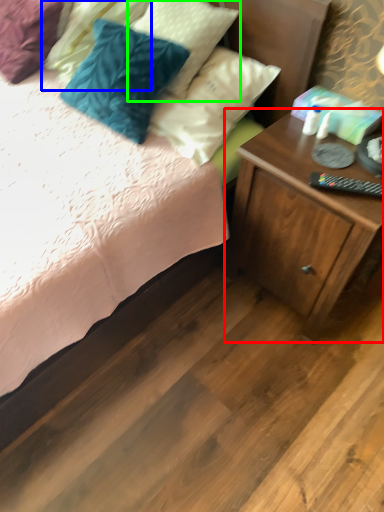
Question: Which object is the farthest from nightstand (highlighted by a red box)? Choose among these: pillow (highlighted by a blue box) or pillow (highlighted by a green box).

Choices:
 (A) pillow
 (B) pillow

Answer: (A)